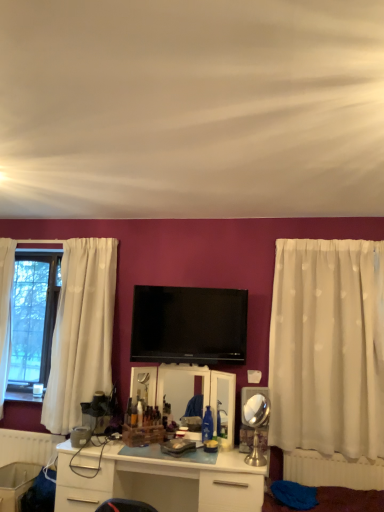
The image size is (384, 512). What are the coordinates of `free space above white plastic radiator at lower right, which is the second radiator from back to front (from a real-world perspective)` in the screenshot? It's located at (334, 452).